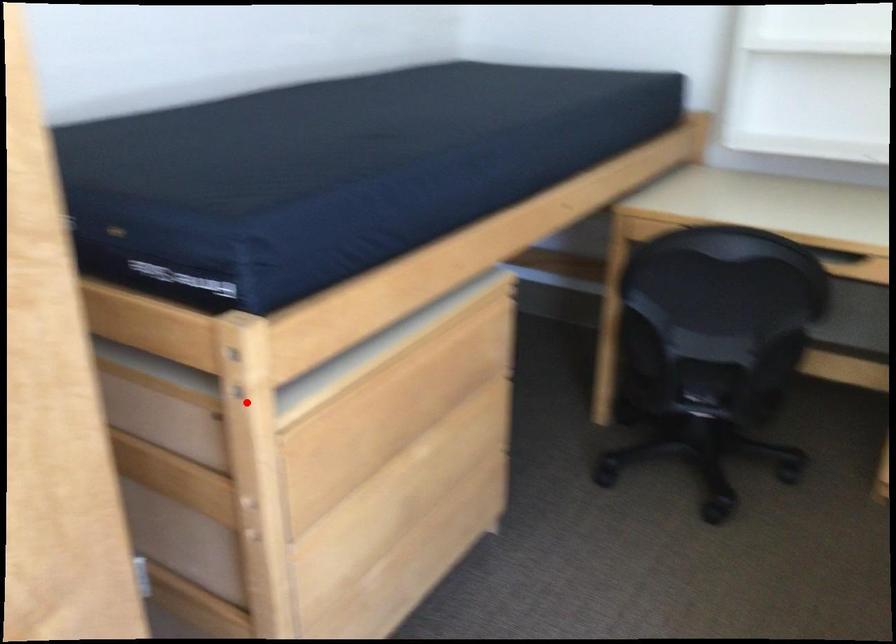
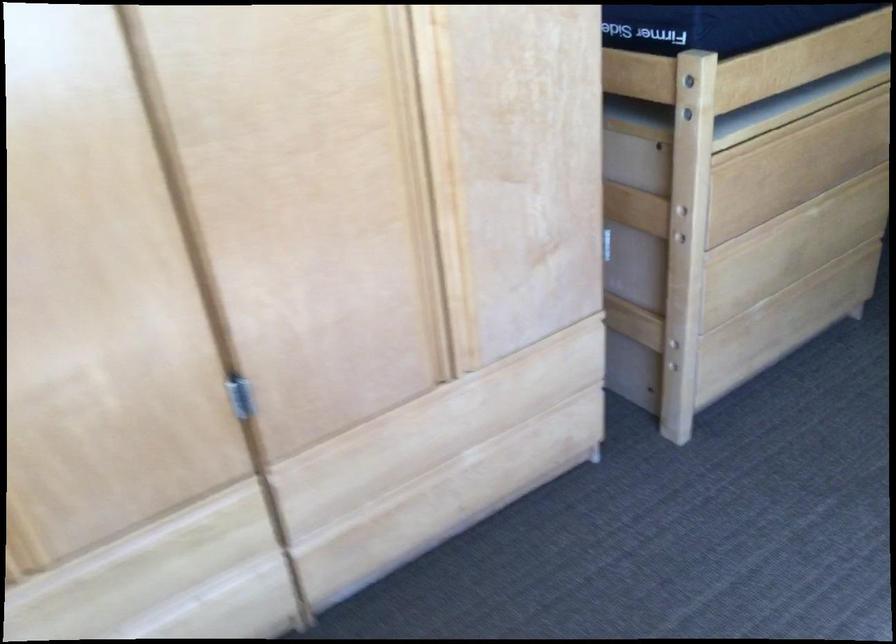
Question: I am providing you with two images of the same scene from different viewpoints. A red point is shown in image1. For the corresponding object point in image2, is it positioned nearer or farther from the camera?

Choices:
 (A) Nearer
 (B) Farther

Answer: (B)